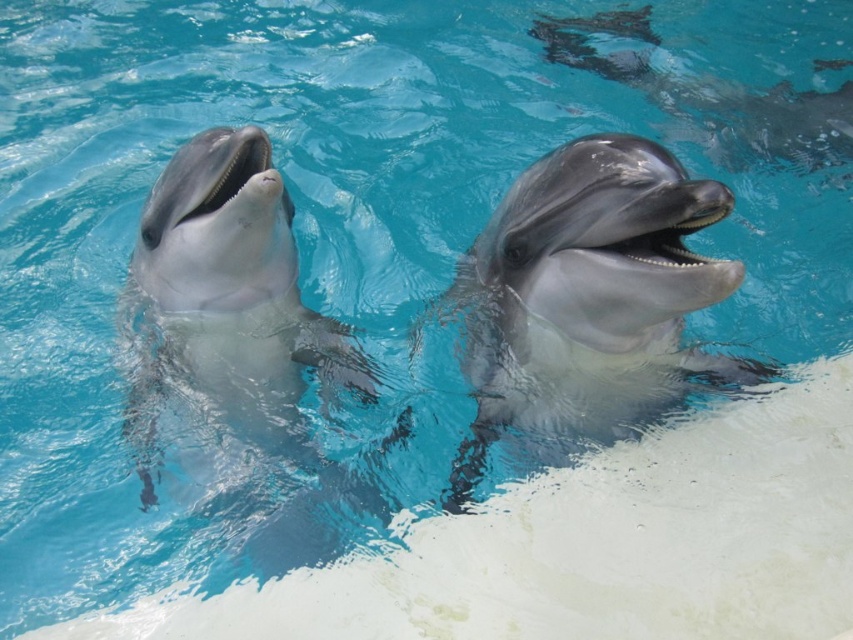
Question: Is sleek gray dolphin at center in front of smooth gray dolphin at center?

Choices:
 (A) no
 (B) yes

Answer: (B)

Question: Among these points, which one is farthest from the camera?

Choices:
 (A) (651, 356)
 (B) (296, 372)
 (C) (793, 148)

Answer: (C)

Question: Considering the relative positions of smooth gray dolphin at center and glossy gray dolphin at upper right in the image provided, where is smooth gray dolphin at center located with respect to glossy gray dolphin at upper right?

Choices:
 (A) below
 (B) above

Answer: (A)

Question: Which of the following is the farthest from the observer?

Choices:
 (A) sleek gray dolphin at center
 (B) glossy gray dolphin at upper right

Answer: (B)

Question: Is sleek gray dolphin at center closer to the viewer compared to smooth gray dolphin at center?

Choices:
 (A) yes
 (B) no

Answer: (A)

Question: Which object is the farthest from the smooth gray dolphin at center?

Choices:
 (A) sleek gray dolphin at center
 (B) glossy gray dolphin at upper right

Answer: (B)